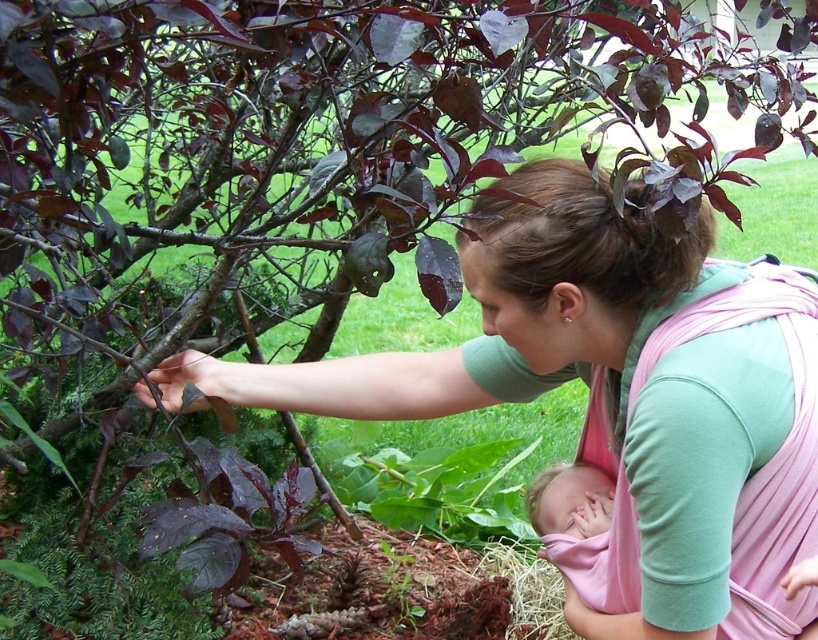
Does pink fabric carrier at center have a greater height compared to pink fabric baby at center?

Yes.

I want to click on pink fabric carrier at center, so click(x=616, y=396).

Is point (614, 364) farther from camera compared to point (537, 493)?

No, it is not.

Identify the location of pink fabric carrier at center. The height and width of the screenshot is (640, 818). (616, 396).

Is haystraw-likehay at lower center thinner than pink fabric baby at lower right?

No, haystraw-likehay at lower center is not thinner than pink fabric baby at lower right.

Describe the element at coordinates (528, 592) in the screenshot. This screenshot has width=818, height=640. I see `haystraw-likehay at lower center` at that location.

Where is `haystraw-likehay at lower center`? haystraw-likehay at lower center is located at coordinates (528, 592).

Who is more forward, (574, 193) or (549, 531)?

Positioned in front is point (574, 193).

Between point (594, 221) and point (608, 490), which one is positioned in front?

Point (594, 221) is more forward.

Locate an element on the screen. The width and height of the screenshot is (818, 640). pink fabric carrier at center is located at coordinates (616, 396).